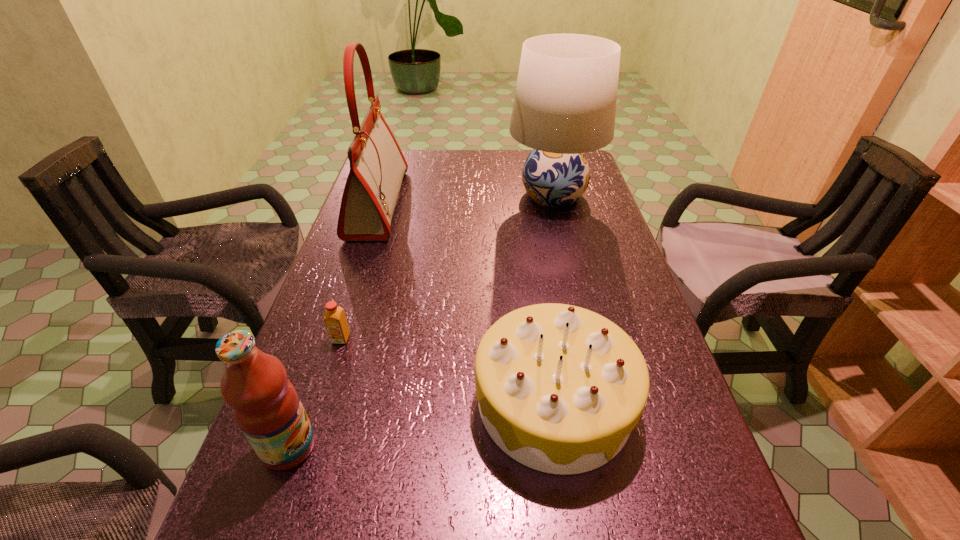
Identify the location of object that is the second nearest to the lampshade. (560, 388).

Identify which object is the third closest to the handbag. Please provide its 2D coordinates. Your answer should be formatted as a tuple, i.e. [(x, y)], where the tuple contains the x and y coordinates of a point satisfying the conditions above.

[(560, 388)]

Locate an element on the screen. vacant space that satisfies the following two spatial constraints: 1. on the front and back of the orange juice; 2. on the front label of the fruit juice is located at coordinates (307, 447).

This screenshot has height=540, width=960. I want to click on free space that satisfies the following two spatial constraints: 1. on the front and back of the orange juice; 2. on the front label of the fruit juice, so click(307, 447).

Where is `free spot that satisfies the following two spatial constraints: 1. on the front side of the handbag; 2. on the front label of the third shortest object`? This screenshot has width=960, height=540. free spot that satisfies the following two spatial constraints: 1. on the front side of the handbag; 2. on the front label of the third shortest object is located at coordinates (298, 447).